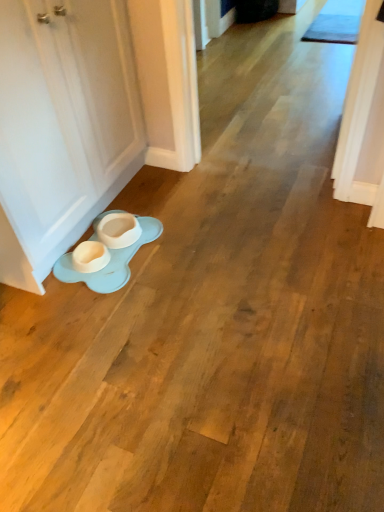
Find the location of a particular element. The image size is (384, 512). light blue rubber saucer at lower left is located at coordinates (109, 262).

What do you see at coordinates (109, 262) in the screenshot? I see `light blue rubber saucer at lower left` at bounding box center [109, 262].

Measure the distance between point (56, 217) and camera.

Point (56, 217) is 1.80 meters from camera.

What do you see at coordinates (62, 126) in the screenshot? The width and height of the screenshot is (384, 512). I see `white matte door at lower left` at bounding box center [62, 126].

Locate an element on the screen. The width and height of the screenshot is (384, 512). white matte door at lower left is located at coordinates (62, 126).

Image resolution: width=384 pixels, height=512 pixels. In order to click on light blue rubber saucer at lower left in this screenshot , I will do pyautogui.click(x=109, y=262).

Considering the relative positions of white matte door at lower left and light blue rubber saucer at lower left in the image provided, is white matte door at lower left to the right of light blue rubber saucer at lower left from the viewer's perspective?

No, white matte door at lower left is not to the right of light blue rubber saucer at lower left.

Is the depth of white matte door at lower left greater than that of light blue rubber saucer at lower left?

That is False.

Between point (20, 35) and point (114, 212), which one is positioned in front?

The point (20, 35) is closer.

From the image's perspective, is white matte door at lower left under light blue rubber saucer at lower left?

No.

From a real-world perspective, which object stands above the other?

white matte door at lower left.

Considering the sizes of objects white matte door at lower left and light blue rubber saucer at lower left in the image provided, who is thinner, white matte door at lower left or light blue rubber saucer at lower left?

white matte door at lower left is thinner.

Is white matte door at lower left shorter than light blue rubber saucer at lower left?

Incorrect, the height of white matte door at lower left does not fall short of that of light blue rubber saucer at lower left.

Who is smaller, white matte door at lower left or light blue rubber saucer at lower left?

Smaller between the two is light blue rubber saucer at lower left.

Would you say white matte door at lower left contains light blue rubber saucer at lower left?

No, light blue rubber saucer at lower left is not inside white matte door at lower left.

Are white matte door at lower left and light blue rubber saucer at lower left far apart?

No, there isn't a large distance between white matte door at lower left and light blue rubber saucer at lower left.

Does white matte door at lower left turn towards light blue rubber saucer at lower left?

Yes, white matte door at lower left is oriented towards light blue rubber saucer at lower left.

How different are the orientations of white matte door at lower left and light blue rubber saucer at lower left in degrees?

There is a 0.0016-degree angle between the facing directions of white matte door at lower left and light blue rubber saucer at lower left.

Find the location of a particular element. Image resolution: width=384 pixels, height=512 pixels. door that is above the light blue rubber saucer at lower left (from the image's perspective) is located at coordinates (62, 126).

Considering the positions of objects light blue rubber saucer at lower left and white matte door at lower left in the image provided, who is more to the right, light blue rubber saucer at lower left or white matte door at lower left?

Positioned to the right is light blue rubber saucer at lower left.

Is the depth of light blue rubber saucer at lower left less than that of white matte door at lower left?

No, the depth of light blue rubber saucer at lower left is greater than that of white matte door at lower left.

Is point (142, 242) more distant than point (4, 47)?

Yes, it is behind point (4, 47).

From the image's perspective, which object appears higher, light blue rubber saucer at lower left or white matte door at lower left?

white matte door at lower left is shown above in the image.

From a real-world perspective, is light blue rubber saucer at lower left below white matte door at lower left?

Yes, from a real-world perspective, light blue rubber saucer at lower left is under white matte door at lower left.

Which of these two, light blue rubber saucer at lower left or white matte door at lower left, is thinner?

white matte door at lower left is thinner.

Which of these two, light blue rubber saucer at lower left or white matte door at lower left, stands shorter?

light blue rubber saucer at lower left.

In terms of size, does light blue rubber saucer at lower left appear bigger or smaller than white matte door at lower left?

Clearly, light blue rubber saucer at lower left is smaller in size than white matte door at lower left.

Is light blue rubber saucer at lower left situated inside white matte door at lower left or outside?

light blue rubber saucer at lower left is not inside white matte door at lower left, it's outside.

Does light blue rubber saucer at lower left touch white matte door at lower left?

No, light blue rubber saucer at lower left is not making contact with white matte door at lower left.

Is white matte door at lower left at the back of light blue rubber saucer at lower left?

No, light blue rubber saucer at lower left's orientation is not away from white matte door at lower left.

Locate an element on the screen. saucer that appears below the white matte door at lower left (from a real-world perspective) is located at coordinates (109, 262).

Identify the location of door above the light blue rubber saucer at lower left (from the image's perspective). Image resolution: width=384 pixels, height=512 pixels. (62, 126).

What are the coordinates of `saucer below the white matte door at lower left (from the image's perspective)` in the screenshot? It's located at (109, 262).